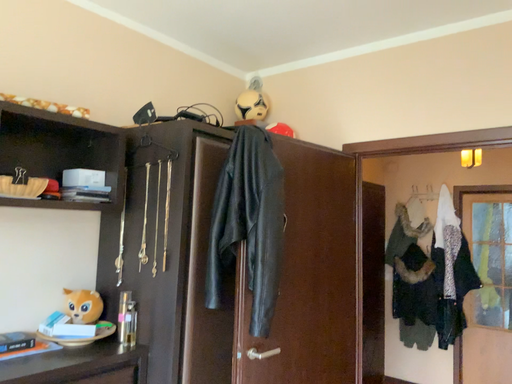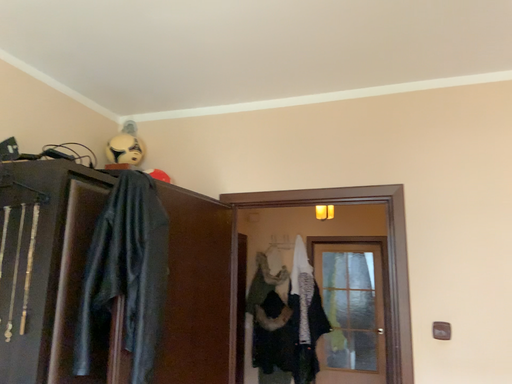
Question: Which way did the camera rotate in the video?

Choices:
 (A) rotated upward
 (B) rotated downward

Answer: (A)